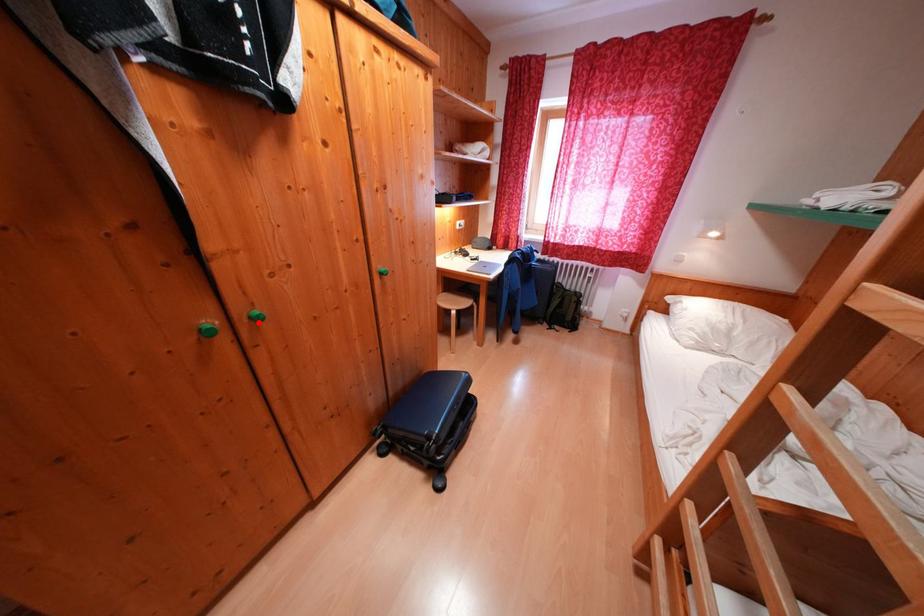
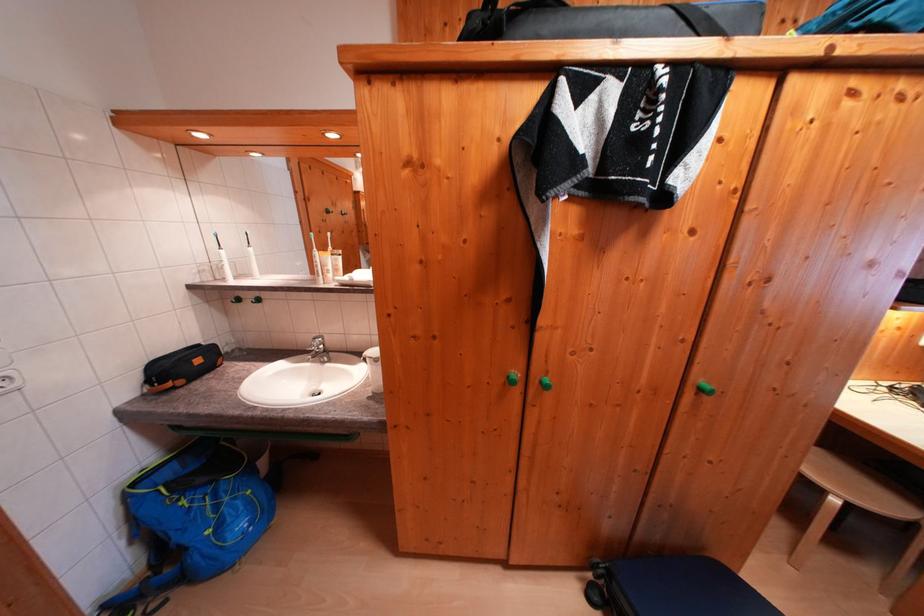
Where in the second image is the point corresponding to the highlighted location from the first image?

(550, 387)